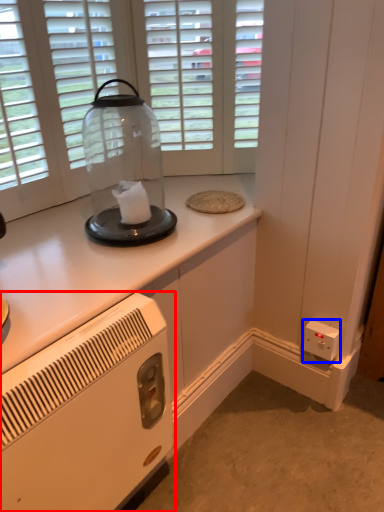
Question: Among these objects, which one is farthest to the camera, home appliance (highlighted by a red box) or electric outlet (highlighted by a blue box)?

Choices:
 (A) home appliance
 (B) electric outlet

Answer: (B)